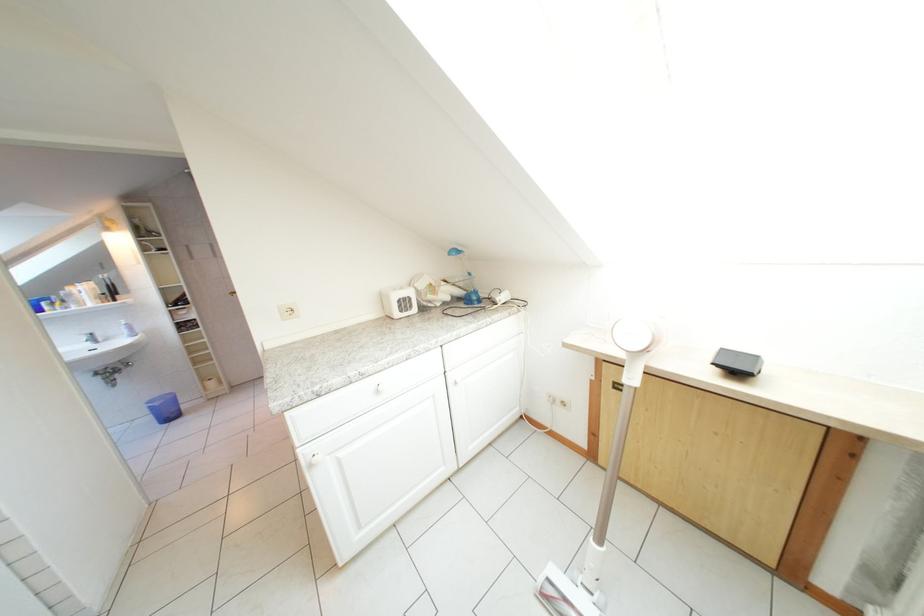
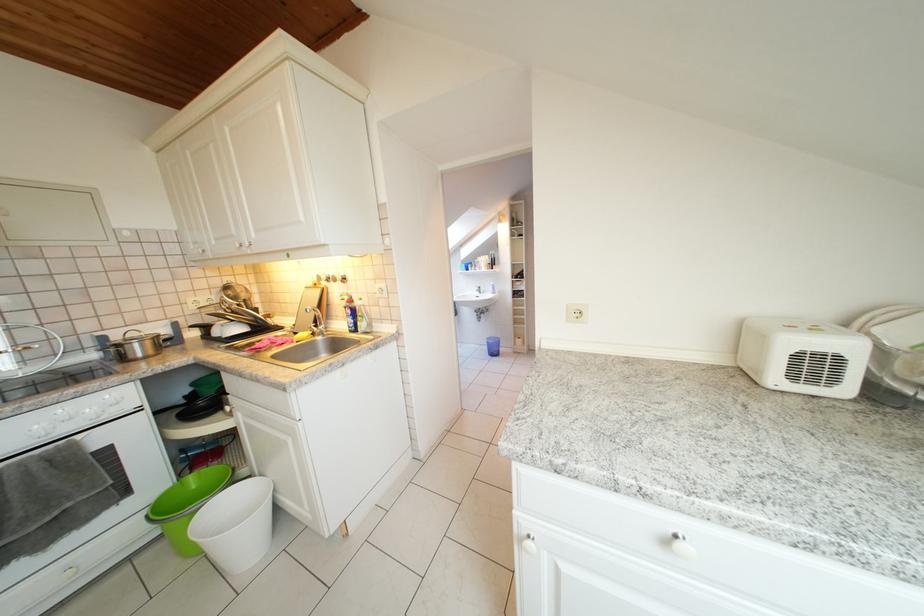
Question: The images are taken continuously from a first-person perspective. In which direction is your viewpoint rotating?

Choices:
 (A) Left
 (B) Right
 (C) Up
 (D) Down

Answer: (A)